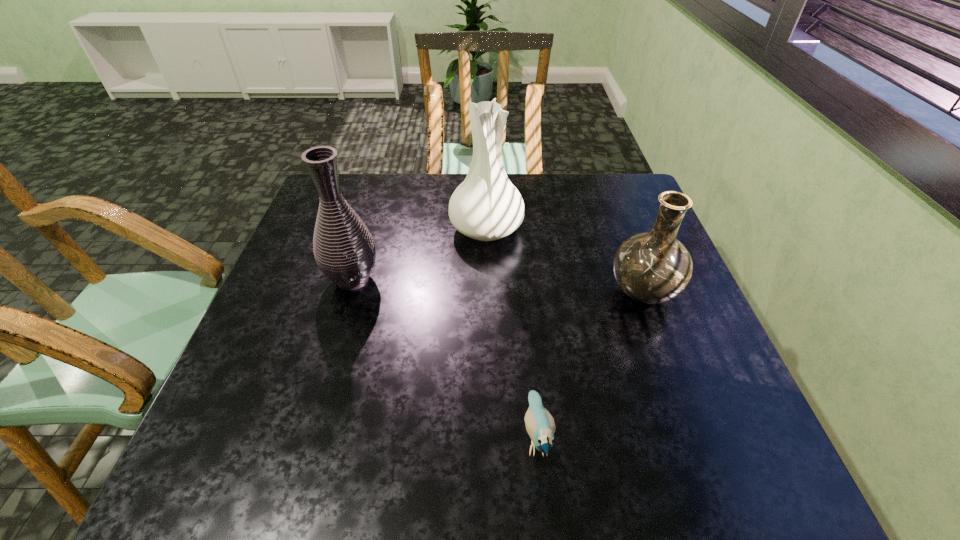
Point out which vase is positioned as the second nearest to the leftmost object. Please provide its 2D coordinates. Your answer should be formatted as a tuple, i.e. [(x, y)], where the tuple contains the x and y coordinates of a point satisfying the conditions above.

[(653, 267)]

The image size is (960, 540). I want to click on free spot that satisfies the following two spatial constraints: 1. on the front side of the farthest object; 2. on the right side of the rightmost vase, so click(x=487, y=293).